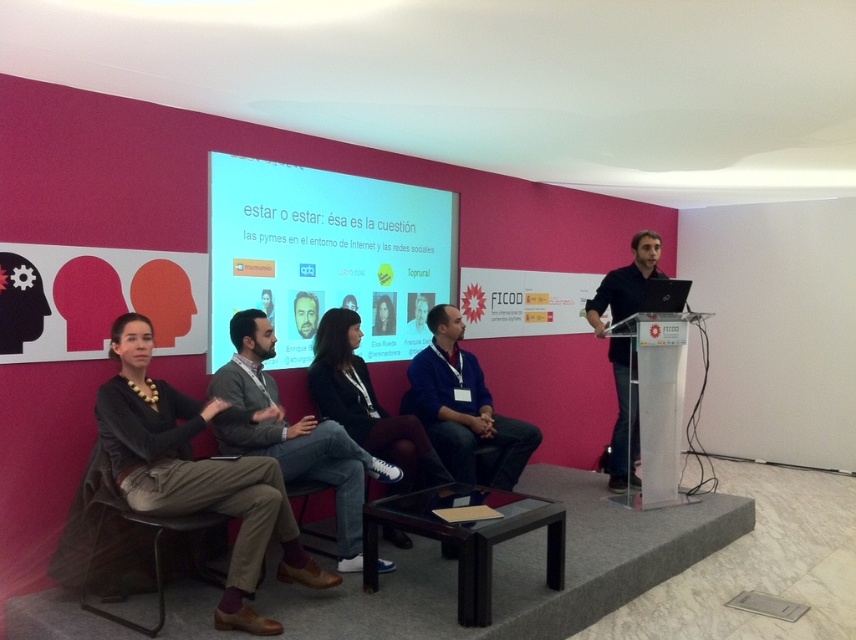
Who is shorter, matte plastic screen at center or black matte shirt at right?

With less height is matte plastic screen at center.

Who is lower down, matte plastic screen at center or black matte shirt at right?

black matte shirt at right

Describe the element at coordinates (325, 256) in the screenshot. I see `matte plastic screen at center` at that location.

Locate an element on the screen. matte plastic screen at center is located at coordinates (325, 256).

The image size is (856, 640). Describe the element at coordinates (197, 474) in the screenshot. I see `dark gray sweater at left` at that location.

Is point (167, 500) more distant than point (384, 529)?

No, it is not.

Measure the distance between point (180, 472) and camera.

They are 9.19 feet apart.

Where is `dark gray sweater at left`? Image resolution: width=856 pixels, height=640 pixels. dark gray sweater at left is located at coordinates [x=197, y=474].

Is dark gray sweater at left above gray sweater at center?

Indeed, dark gray sweater at left is positioned over gray sweater at center.

Is point (185, 506) in front of point (235, 369)?

Yes, it is in front of point (235, 369).

Where is `dark gray sweater at left`? The height and width of the screenshot is (640, 856). dark gray sweater at left is located at coordinates (197, 474).